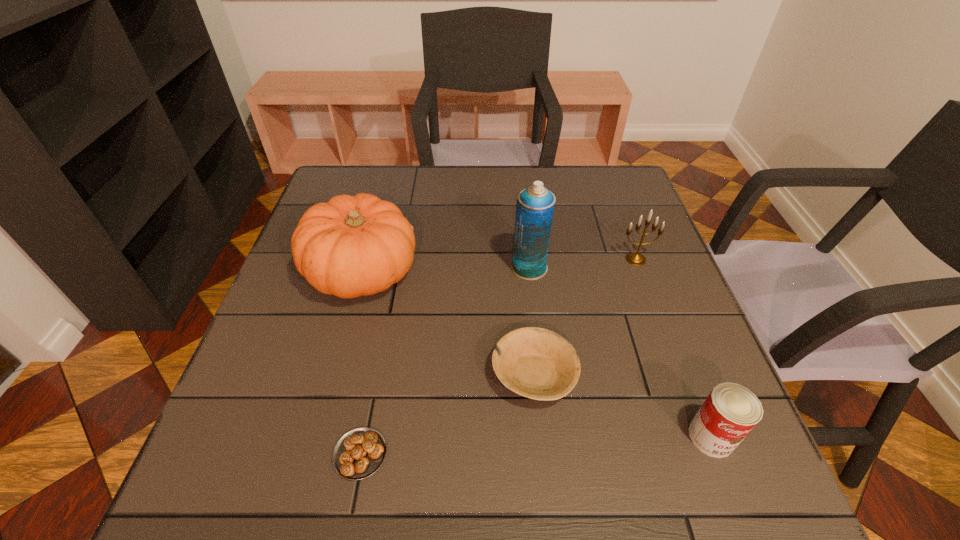
At what (x,y) coordinates should I click in order to perform the action: click on free spot between the fourth shortest object and the can. Please return your answer as a coordinate pair (x, y). This screenshot has width=960, height=540. Looking at the image, I should click on (673, 348).

I want to click on free space between the aerosol can and the third nearest object, so click(532, 321).

The width and height of the screenshot is (960, 540). I want to click on free spot between the tallest object and the pastry, so click(444, 361).

Select which object appears as the fifth closest to the candelabrum. Please provide its 2D coordinates. Your answer should be formatted as a tuple, i.e. [(x, y)], where the tuple contains the x and y coordinates of a point satisfying the conditions above.

[(359, 453)]

The height and width of the screenshot is (540, 960). I want to click on object that ranks as the closest to the fourth farthest object, so click(535, 205).

I want to click on vacant position in the image that satisfies the following two spatial constraints: 1. on the front side of the second tallest object; 2. on the right side of the fourth farthest object, so click(335, 375).

The height and width of the screenshot is (540, 960). I want to click on vacant space that satisfies the following two spatial constraints: 1. on the front side of the fifth tallest object; 2. on the left side of the second tallest object, so (x=335, y=375).